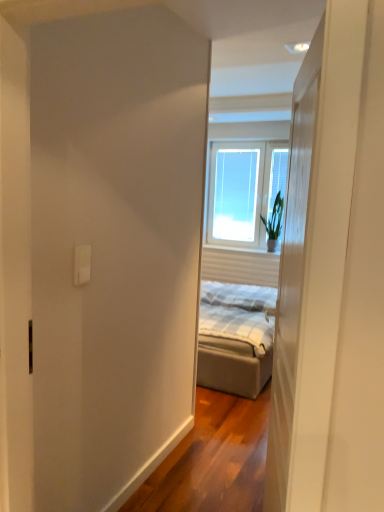
Question: Is white wood door at center closer to the viewer compared to green leafy plant at window?

Choices:
 (A) no
 (B) yes

Answer: (B)

Question: From a real-world perspective, is white wood door at center over green leafy plant at window?

Choices:
 (A) no
 (B) yes

Answer: (A)

Question: Considering the relative sizes of white wood door at center and green leafy plant at window in the image provided, is white wood door at center shorter than green leafy plant at window?

Choices:
 (A) yes
 (B) no

Answer: (B)

Question: Considering the relative positions of white wood door at center and green leafy plant at window in the image provided, is white wood door at center to the left of green leafy plant at window from the viewer's perspective?

Choices:
 (A) no
 (B) yes

Answer: (B)

Question: Is white wood door at center with green leafy plant at window?

Choices:
 (A) yes
 (B) no

Answer: (B)

Question: From a real-world perspective, is white wood door at center below green leafy plant at window?

Choices:
 (A) yes
 (B) no

Answer: (A)

Question: Does white wood door at center lie behind white plastic outlet at upper left?

Choices:
 (A) yes
 (B) no

Answer: (B)

Question: Does white wood door at center appear on the left side of white plastic outlet at upper left?

Choices:
 (A) yes
 (B) no

Answer: (B)

Question: Is white wood door at center far from white plastic outlet at upper left?

Choices:
 (A) no
 (B) yes

Answer: (A)

Question: Does white wood door at center have a larger size compared to white plastic outlet at upper left?

Choices:
 (A) no
 (B) yes

Answer: (B)

Question: Would you say white plastic outlet at upper left is part of white wood door at center's contents?

Choices:
 (A) no
 (B) yes

Answer: (A)

Question: Considering the relative sizes of white wood door at center and white plastic outlet at upper left in the image provided, is white wood door at center taller than white plastic outlet at upper left?

Choices:
 (A) no
 (B) yes

Answer: (B)

Question: Does clear glass window at center, the second window when ordered from left to right, have a lesser width compared to green leafy plant at window?

Choices:
 (A) no
 (B) yes

Answer: (B)